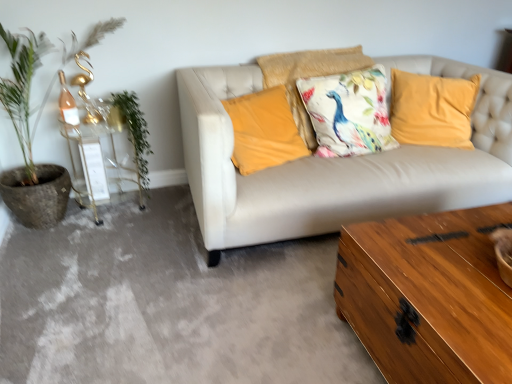
Locate an element on the screen. The height and width of the screenshot is (384, 512). free location to the right of green leafy plant at left is located at coordinates (165, 229).